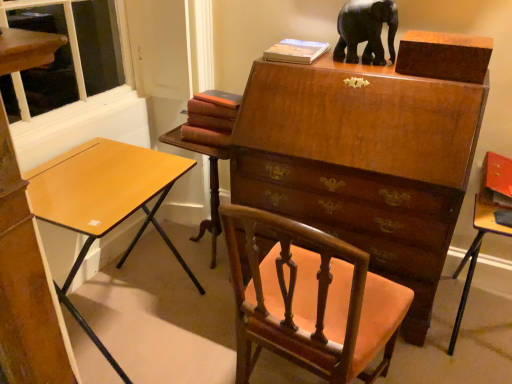
Question: Is maroon leather book at center, the 2th book viewed from the top, inside or outside of mahogany wood table at center, which appears as the 2th table when viewed from the right?

Choices:
 (A) outside
 (B) inside

Answer: (A)

Question: Considering their positions, is maroon leather book at center, which ranks as the 1th book in left-to-right order, located in front of or behind mahogany wood table at center, which is the first table in left-to-right order?

Choices:
 (A) behind
 (B) front

Answer: (B)

Question: Which object is the farthest from the maroon leather book at center, which is the 1th book from bottom to top?

Choices:
 (A) mahogany wood table at center, which is the first table in left-to-right order
 (B) light brown wood desk at left
 (C) mahogany wood chair at center
 (D) hardcover book at upper center, acting as the 1th book starting from the top
 (E) black glossy elephant at upper center

Answer: (C)

Question: Which is nearer to the matte orange table at right, which ranks as the second table in left-to-right order?

Choices:
 (A) mahogany wood table at center, which appears as the 2th table when viewed from the right
 (B) mahogany wood chair at center
 (C) light brown wood desk at left
 (D) maroon leather book at center, the 2th book viewed from the top
 (E) black glossy elephant at upper center

Answer: (B)